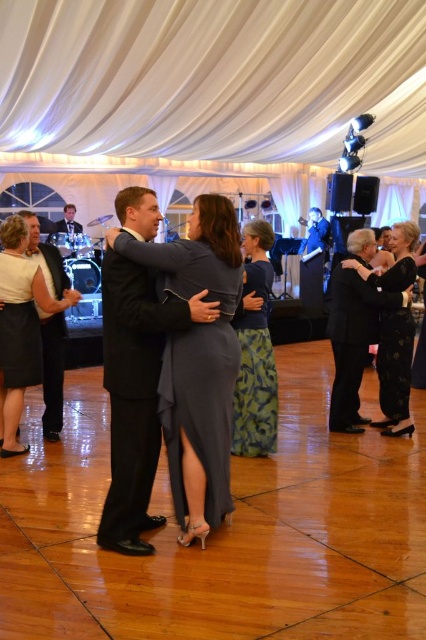
In the image, there is a point marked at coordinates (199,376). What object is located at this point?

The point at coordinates (199,376) marks the satin gray dress at center.

You are standing at point (x=3, y=298) and want to walk to the exit located at point (x=382, y=403). Is there any obstacle between you and the exit?

Point (x=382, y=403) is behind point (x=3, y=298), so there is no obstacle between you and the exit.

You are a photographer at the event and want to capture a clear shot of both the satin gray dress at center and the matte white dress at left. Which dress will appear larger in the photo?

The satin gray dress at center will appear larger in the photo because it is closer to the viewer than the matte white dress at left.